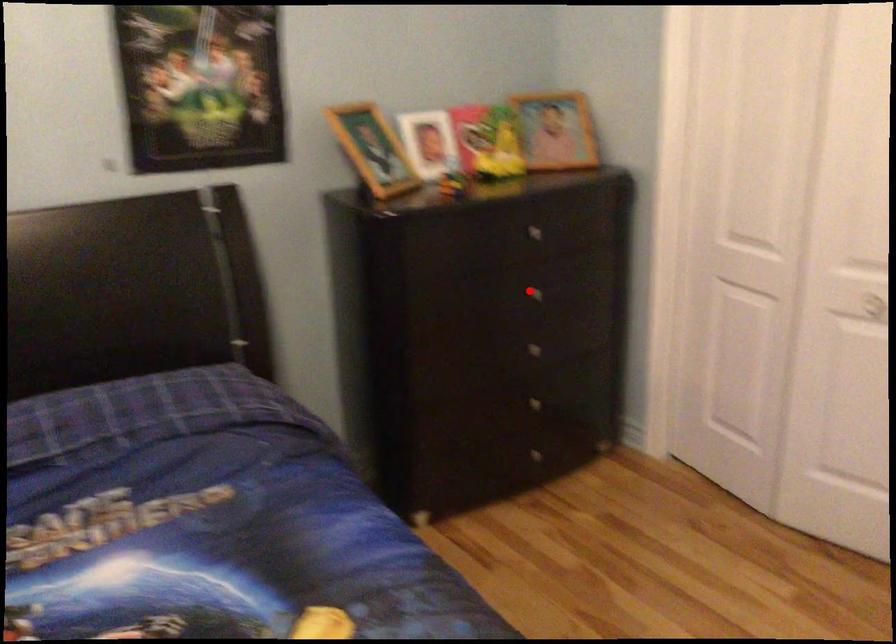
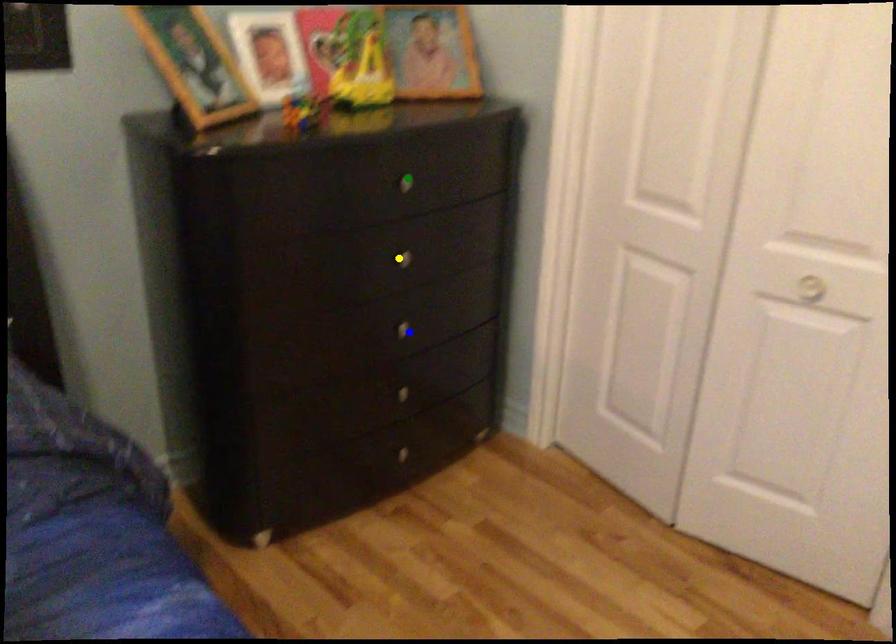
Question: I am providing you with two images of the same scene from different viewpoints. A red point is marked on the first image. You are given multiple points on the second image. Which spot in image 2 lines up with the point in image 1?

Choices:
 (A) yellow point
 (B) green point
 (C) blue point

Answer: (A)